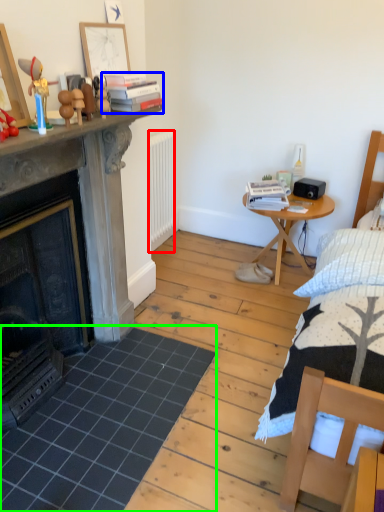
Question: Which is farther away from radiator (highlighted by a red box)? book (highlighted by a blue box) or tile (highlighted by a green box)?

Choices:
 (A) book
 (B) tile

Answer: (B)